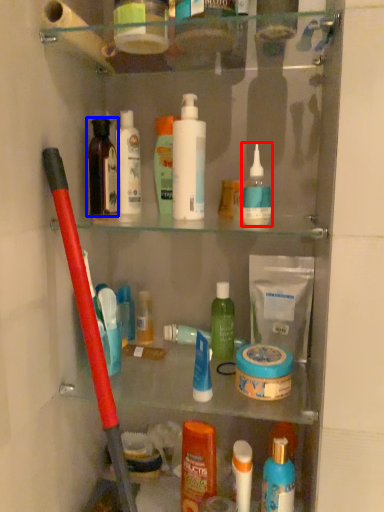
Question: Which of the following is the closest to the observer, cleaning product (highlighted by a red box) or toiletry (highlighted by a blue box)?

Choices:
 (A) cleaning product
 (B) toiletry

Answer: (A)